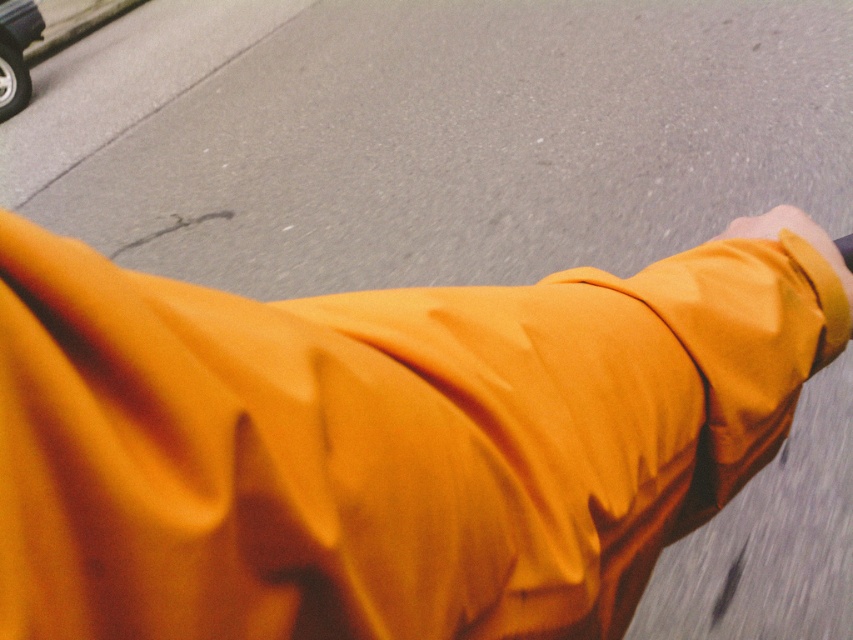
Is matte orange robe at center smaller than shiny silver car at upper left?

Correct, matte orange robe at center occupies less space than shiny silver car at upper left.

In the scene shown: Is matte orange robe at center thinner than shiny silver car at upper left?

In fact, matte orange robe at center might be wider than shiny silver car at upper left.

Is point (431, 584) closer to camera compared to point (21, 45)?

That is True.

At what (x,y) coordinates should I click in order to perform the action: click on matte orange robe at center. Please return your answer as a coordinate pair (x, y). Looking at the image, I should click on (x=381, y=442).